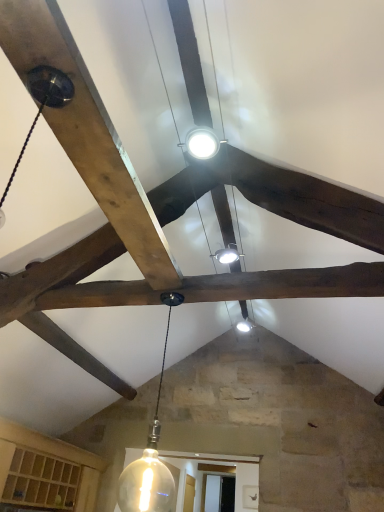
Image resolution: width=384 pixels, height=512 pixels. Identify the location of clear glass pendant light at center. (150, 458).

What do you see at coordinates (150, 458) in the screenshot? The height and width of the screenshot is (512, 384). I see `clear glass pendant light at center` at bounding box center [150, 458].

Find the location of a particular element. This screenshot has width=384, height=512. clear glass pendant light at center is located at coordinates (150, 458).